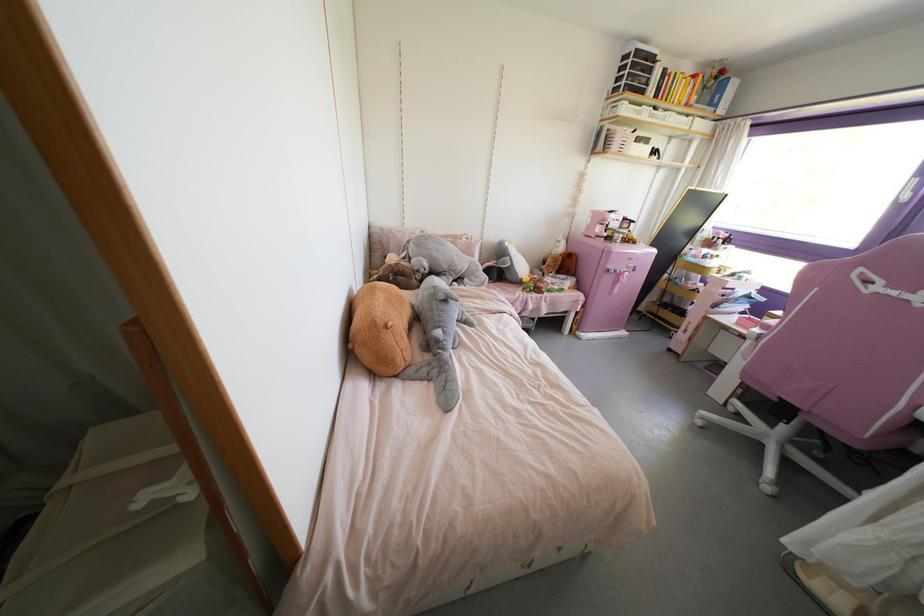
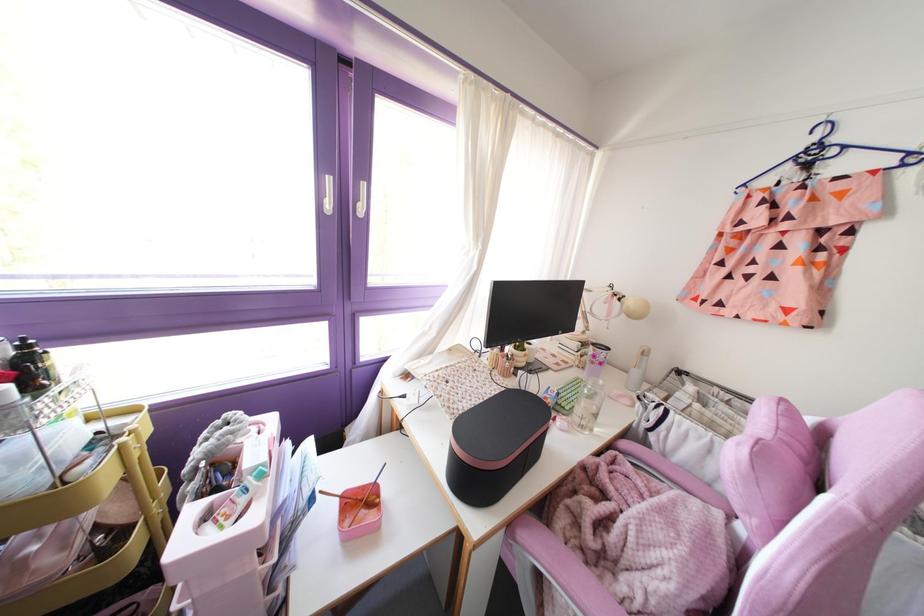
Locate, in the second image, the point that corresponds to the point at 738,278 in the first image.

(261, 475)